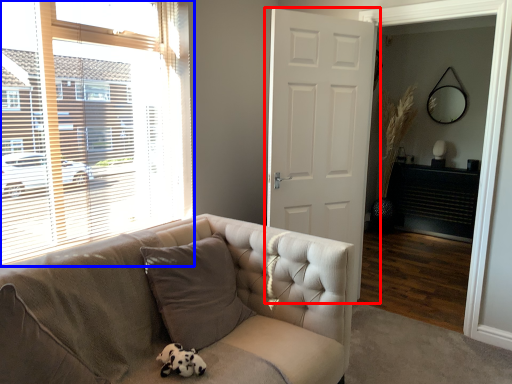
Question: Among these objects, which one is nearest to the camera, door (highlighted by a red box) or window (highlighted by a blue box)?

Choices:
 (A) door
 (B) window

Answer: (B)